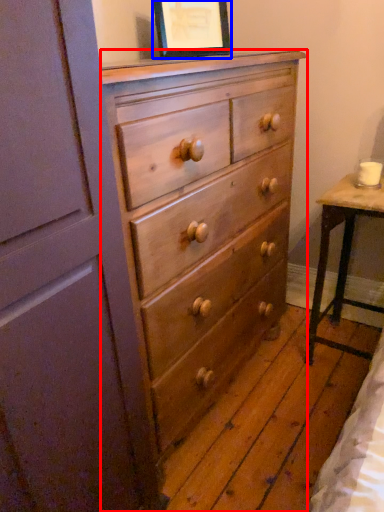
Question: Which point is further to the camera, chest of drawers (highlighted by a red box) or picture frame (highlighted by a blue box)?

Choices:
 (A) chest of drawers
 (B) picture frame

Answer: (B)